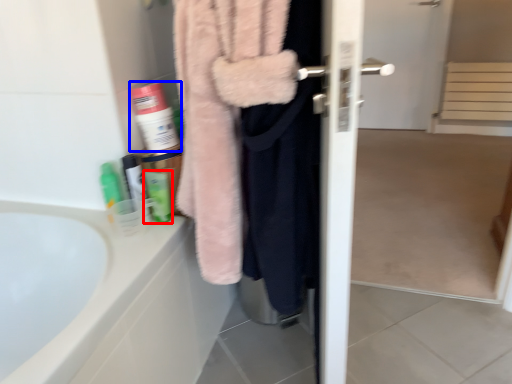
Question: Which of the following is the farthest to the observer, toiletry (highlighted by a red box) or cleaning product (highlighted by a blue box)?

Choices:
 (A) toiletry
 (B) cleaning product

Answer: (B)